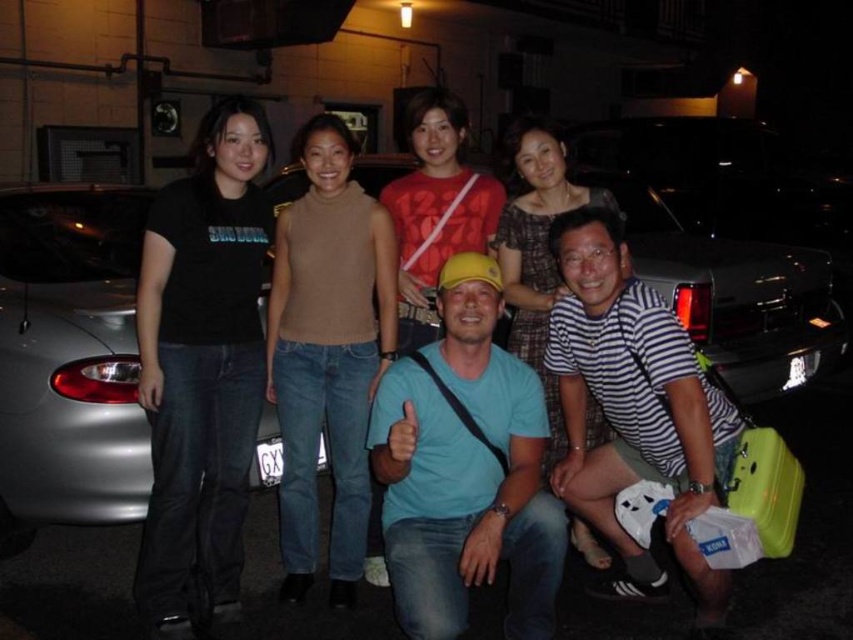
This screenshot has width=853, height=640. I want to click on silver metallic car at left, so click(x=71, y=353).

Which is more to the right, silver metallic car at left or knit beige sweater at center?

knit beige sweater at center

Does point (100, 404) lie behind point (357, 346)?

No.

Find the location of a particular element. silver metallic car at left is located at coordinates (71, 353).

What do you see at coordinates (201, 369) in the screenshot? I see `black cotton t-shirt at left` at bounding box center [201, 369].

What do you see at coordinates (201, 369) in the screenshot? I see `black cotton t-shirt at left` at bounding box center [201, 369].

Find the location of a particular element. This screenshot has height=640, width=853. black cotton t-shirt at left is located at coordinates (201, 369).

Measure the distance between black cotton t-shirt at left and camera.

They are 2.68 meters apart.

In the scene shown: Between black cotton t-shirt at left and knit beige sweater at center, which one appears on the right side from the viewer's perspective?

From the viewer's perspective, knit beige sweater at center appears more on the right side.

Find the location of a particular element. This screenshot has width=853, height=640. black cotton t-shirt at left is located at coordinates (201, 369).